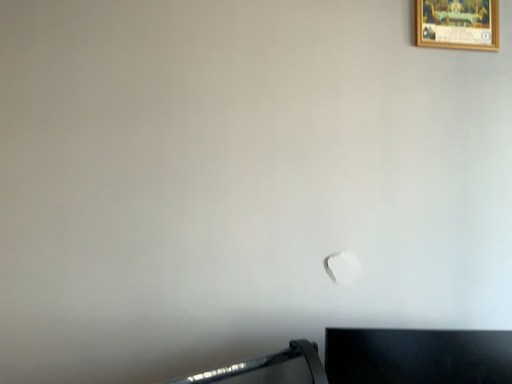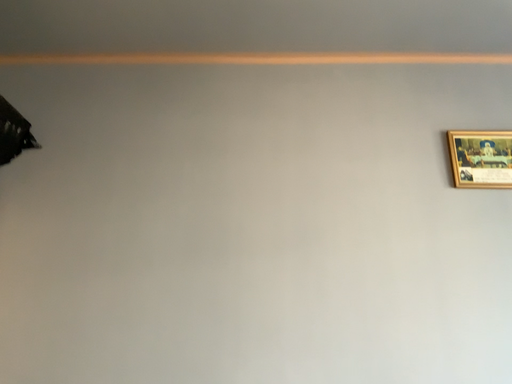
Question: How did the camera likely rotate when shooting the video?

Choices:
 (A) rotated left
 (B) rotated right

Answer: (A)